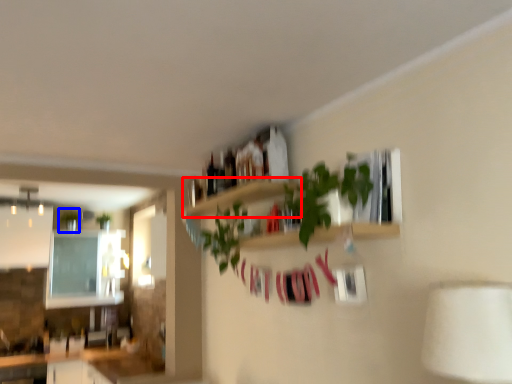
Question: Which object appears farthest to the camera in this image, shelf (highlighted by a red box) or plant (highlighted by a blue box)?

Choices:
 (A) shelf
 (B) plant

Answer: (B)